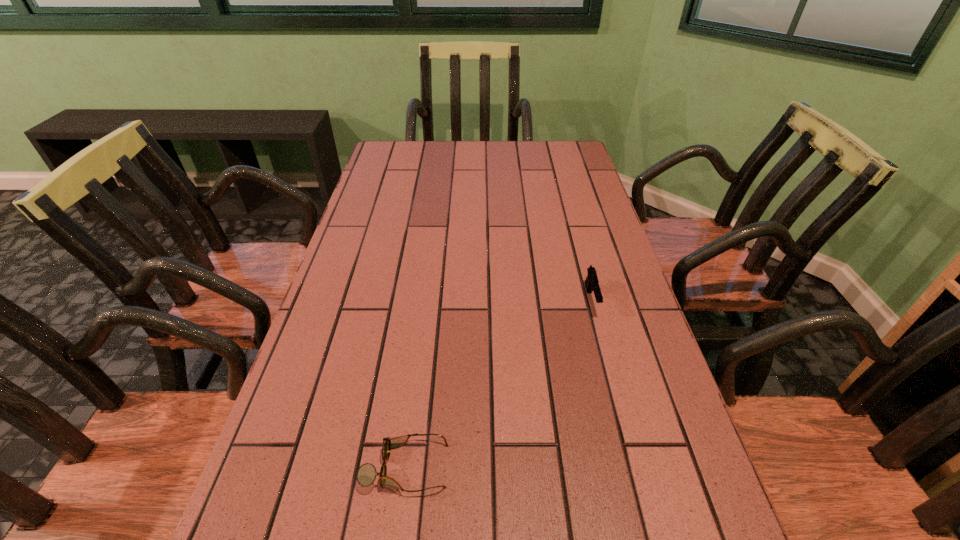
Find the location of a particular element. This screenshot has height=540, width=960. free space at the far left corner of the desktop is located at coordinates (386, 164).

The width and height of the screenshot is (960, 540). I want to click on free space at the far right corner of the desktop, so click(553, 143).

The height and width of the screenshot is (540, 960). Identify the location of free space that satisfies the following two spatial constraints: 1. on the front-facing side of the taller object; 2. on the front-facing side of the spectacles. (636, 467).

Where is `free location that satisfies the following two spatial constraints: 1. on the front-facing side of the farther object; 2. on the front-facing side of the nearer object`? free location that satisfies the following two spatial constraints: 1. on the front-facing side of the farther object; 2. on the front-facing side of the nearer object is located at coordinates (636, 467).

Where is `free spot that satisfies the following two spatial constraints: 1. on the front-facing side of the taller object; 2. on the front-facing side of the left object`? This screenshot has height=540, width=960. free spot that satisfies the following two spatial constraints: 1. on the front-facing side of the taller object; 2. on the front-facing side of the left object is located at coordinates (636, 467).

Where is `vacant space that satisfies the following two spatial constraints: 1. on the front-facing side of the taller object; 2. on the front-facing side of the shorter object`? This screenshot has width=960, height=540. vacant space that satisfies the following two spatial constraints: 1. on the front-facing side of the taller object; 2. on the front-facing side of the shorter object is located at coordinates (636, 467).

Find the location of a particular element. The height and width of the screenshot is (540, 960). vacant area that satisfies the following two spatial constraints: 1. on the front-facing side of the farther object; 2. on the front-facing side of the nearer object is located at coordinates (636, 467).

You are a GUI agent. You are given a task and a screenshot of the screen. Output one action in this format:
    pyautogui.click(x=<x>, y=<y>)
    Task: Click on the free space in the image that satisfies the following two spatial constraints: 1. on the front-facing side of the pistol; 2. on the front-facing side of the left object
    This screenshot has height=540, width=960.
    Given the screenshot: What is the action you would take?
    pyautogui.click(x=636, y=467)

Identify the location of vacant region that satisfies the following two spatial constraints: 1. on the front-facing side of the farther object; 2. on the front-facing side of the spectacles. [636, 467].

This screenshot has height=540, width=960. I want to click on free space that satisfies the following two spatial constraints: 1. on the front-facing side of the pistol; 2. on the front-facing side of the nearer object, so click(636, 467).